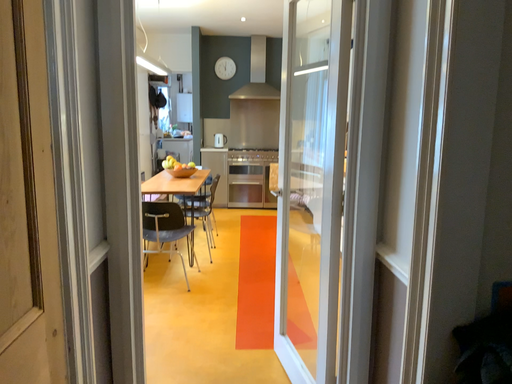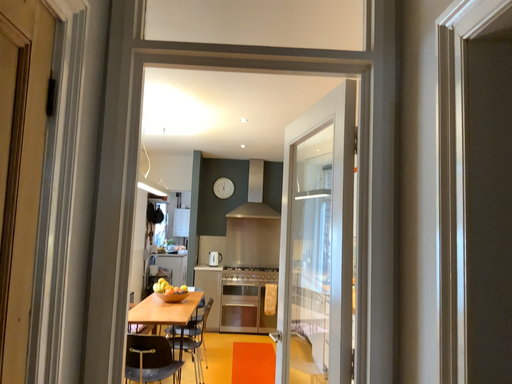
Question: How did the camera likely rotate when shooting the video?

Choices:
 (A) rotated upward
 (B) rotated downward

Answer: (A)